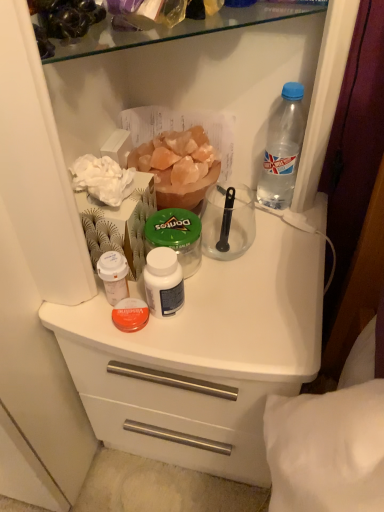
Locate an element on the screen. This screenshot has height=512, width=384. free spot to the right of white matte plastic cup at upper left, the 2th bottle when ordered from right to left is located at coordinates (238, 297).